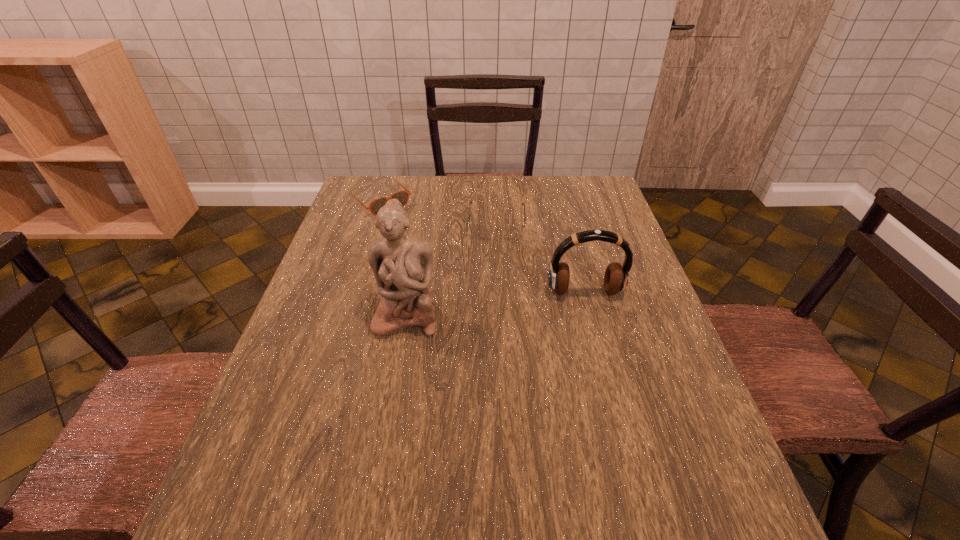
Where is `free space at the left edge of the desktop`? free space at the left edge of the desktop is located at coordinates (343, 379).

Find the location of a particular element. This screenshot has width=960, height=540. free spot at the right edge of the desktop is located at coordinates (588, 266).

In the image, there is a desktop. Identify the location of vacant space at the far right corner. This screenshot has width=960, height=540. (579, 185).

Find the location of `free area in between the second object from right to left and the tallest object`. free area in between the second object from right to left and the tallest object is located at coordinates (452, 269).

Identify the location of unoccupied area between the tallest object and the second tallest object. The height and width of the screenshot is (540, 960). (495, 304).

Find the location of a particular element. free spot between the spectacles and the tallest object is located at coordinates (452, 269).

What are the coordinates of `free spot between the tallest object and the third object from left to right` in the screenshot? It's located at (452, 269).

Where is `unoccupied position between the rightmost object and the sunglasses`? The image size is (960, 540). unoccupied position between the rightmost object and the sunglasses is located at coordinates (x=482, y=247).

You are a GUI agent. You are given a task and a screenshot of the screen. Output one action in this format:
    pyautogui.click(x=<x>, y=<y>)
    Task: Click on the free point between the figurine and the second tallest object
    The image size is (960, 540).
    Given the screenshot: What is the action you would take?
    pyautogui.click(x=495, y=304)

The image size is (960, 540). What are the coordinates of `vacant area that lies between the sunglasses and the rightmost object` in the screenshot? It's located at tap(482, 247).